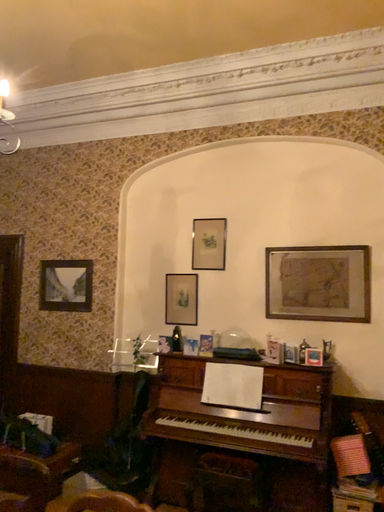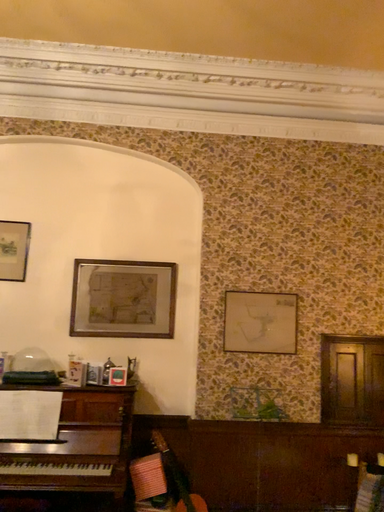
Question: How did the camera likely rotate when shooting the video?

Choices:
 (A) rotated right
 (B) rotated left

Answer: (A)